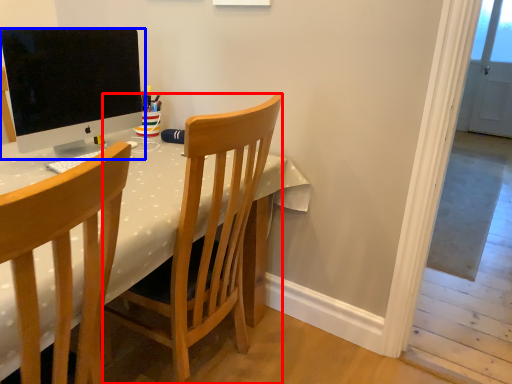
Question: Among these objects, which one is farthest to the camera, chair (highlighted by a red box) or computer monitor (highlighted by a blue box)?

Choices:
 (A) chair
 (B) computer monitor

Answer: (B)